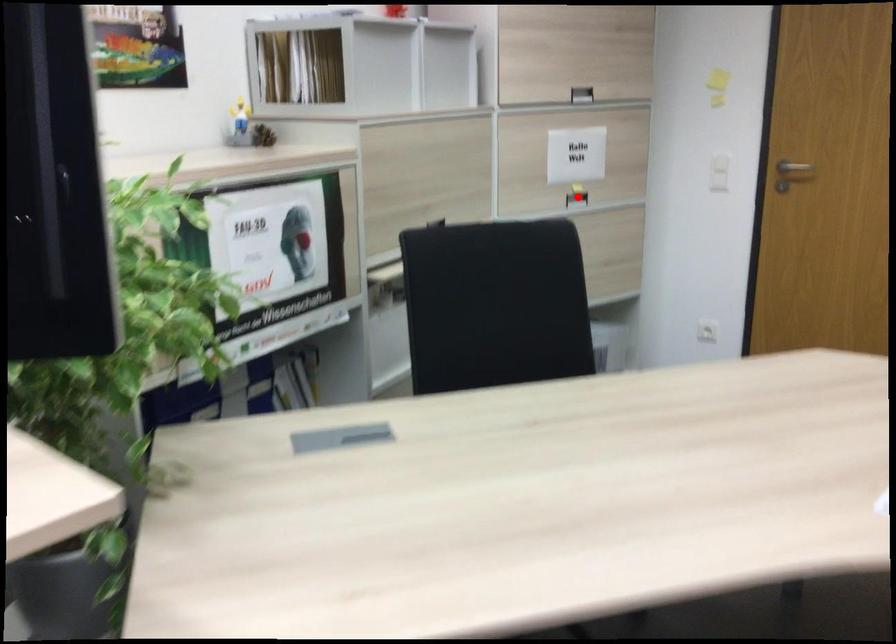
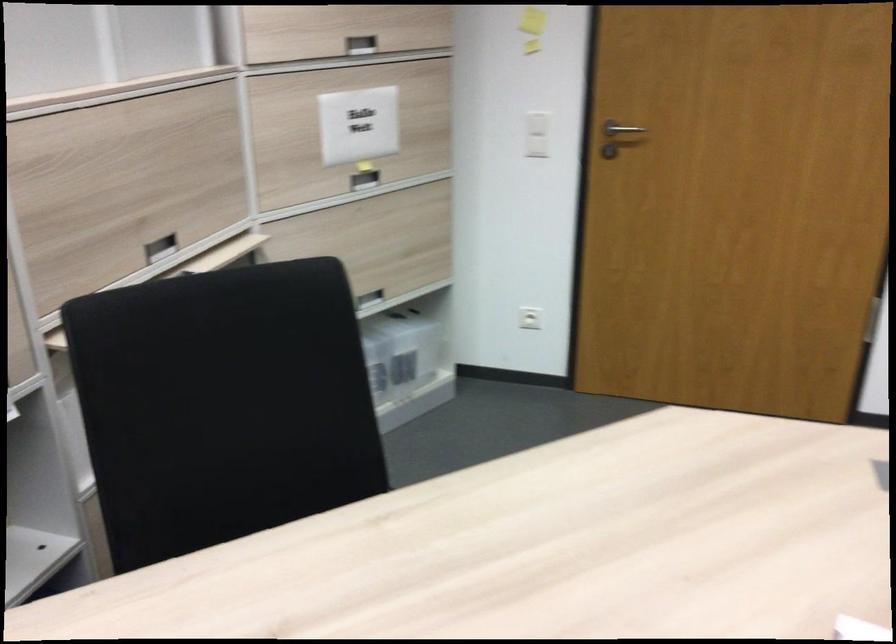
In the second image, find the point that corresponds to the highlighted location in the first image.

(364, 180)